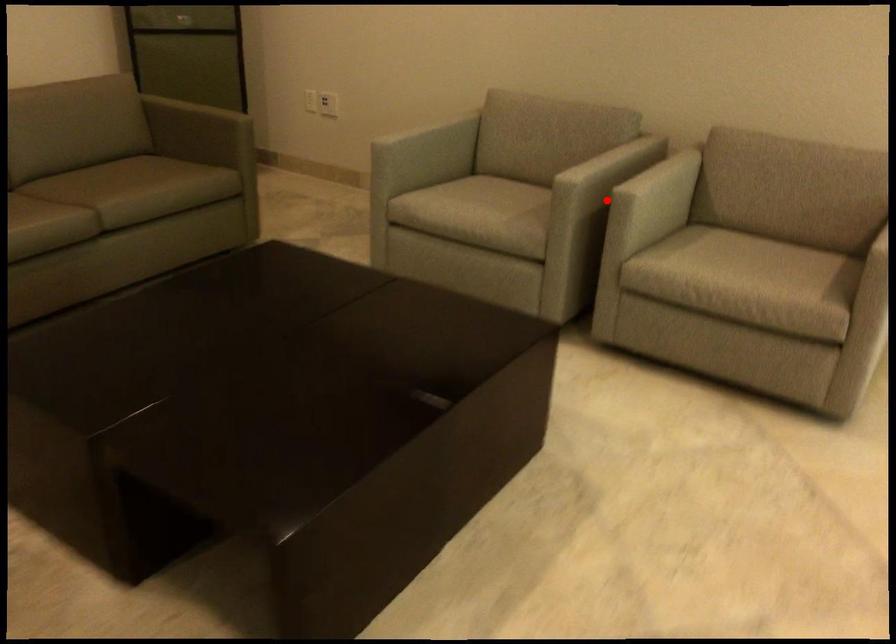
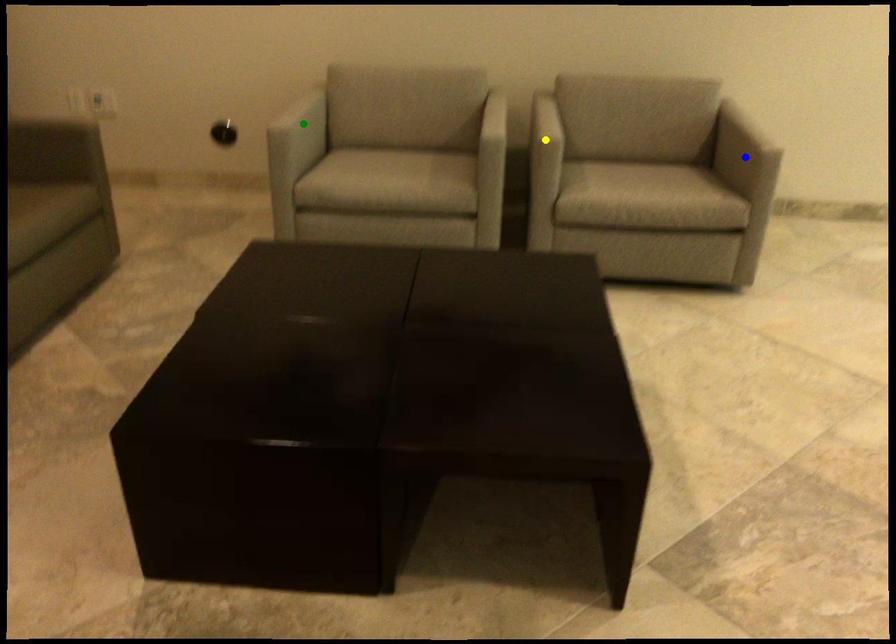
Question: I am providing you with two images of the same scene from different viewpoints. A red point is marked on the first image. You are given multiple points on the second image. Which spot in image 2 lines up with the point in image 1?

Choices:
 (A) yellow point
 (B) blue point
 (C) green point

Answer: (A)